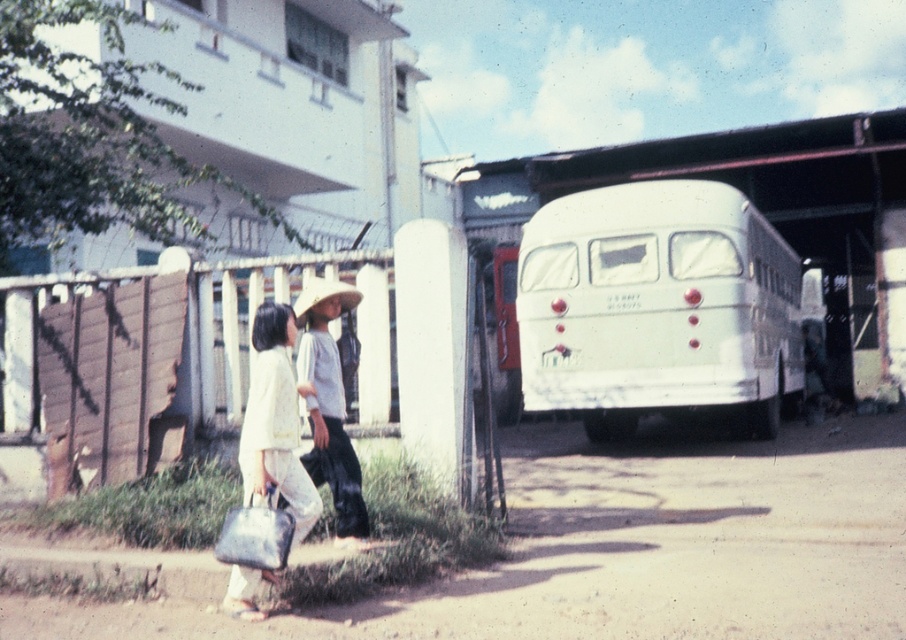
You are a traveler standing on the dirt path and see the white matte bus at center and the white matte hat at center. Which object is larger in size?

The white matte bus at center is bigger than the white matte hat at center.

You are a traveler standing on the dirt path and want to reach the white matte hat at center. Is the white matte bus at center blocking your path?

The white matte bus at center is further to the viewer than the white matte hat at center, so the bus is closer to you. This means the bus is blocking your path to the hat.